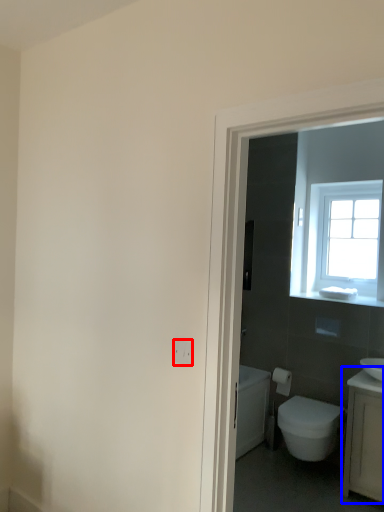
Question: Which object appears farthest to the camera in this image, electric outlet (highlighted by a red box) or counter top (highlighted by a blue box)?

Choices:
 (A) electric outlet
 (B) counter top

Answer: (B)